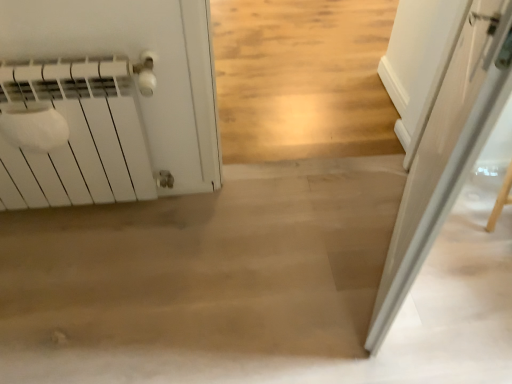
This screenshot has width=512, height=384. I want to click on free space behind white glossy door at right, so click(x=351, y=200).